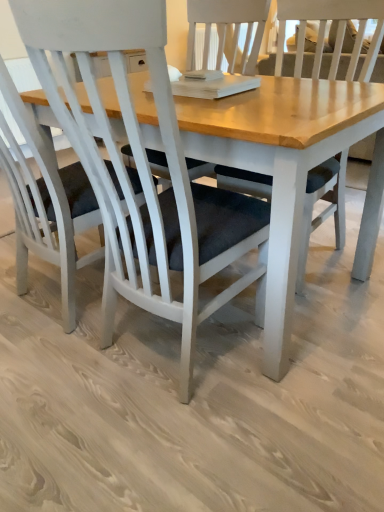
Question: From a real-world perspective, is white matte chair at center, marked as the 1th chair in a left-to-right arrangement, positioned above or below white matte chair at center, which is counted as the 1th chair, starting from the right?

Choices:
 (A) above
 (B) below

Answer: (A)

Question: Is point (82, 215) positioned closer to the camera than point (160, 15)?

Choices:
 (A) farther
 (B) closer

Answer: (A)

Question: Considering the positions of white matte chair at center, marked as the 2th chair in a right-to-left arrangement, and white matte chair at center, the 2th chair from the left, in the image, is white matte chair at center, marked as the 2th chair in a right-to-left arrangement, wider or thinner than white matte chair at center, the 2th chair from the left,?

Choices:
 (A) wide
 (B) thin

Answer: (A)

Question: From the image's perspective, is white matte chair at center, the 2th chair from the left, above or below white matte chair at center, marked as the 2th chair in a right-to-left arrangement?

Choices:
 (A) above
 (B) below

Answer: (B)

Question: Considering their positions, is white matte chair at center, the 2th chair from the left, located in front of or behind white matte chair at center, marked as the 2th chair in a right-to-left arrangement?

Choices:
 (A) front
 (B) behind

Answer: (A)

Question: Based on their positions, is white matte chair at center, which is counted as the 1th chair, starting from the right, located to the left or right of white matte chair at center, marked as the 2th chair in a right-to-left arrangement?

Choices:
 (A) left
 (B) right

Answer: (B)

Question: Which is correct: white matte chair at center, which is counted as the 1th chair, starting from the right, is inside white matte chair at center, marked as the 2th chair in a right-to-left arrangement, or outside of it?

Choices:
 (A) inside
 (B) outside

Answer: (B)